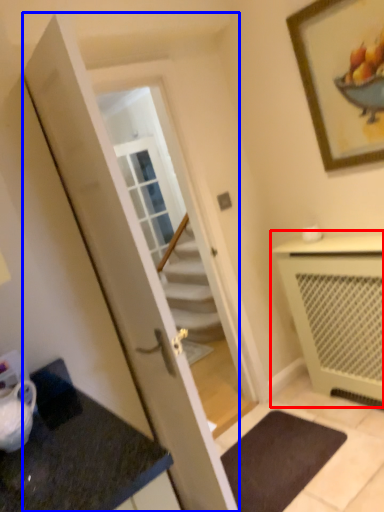
Question: Which point is further to the camera, cabinetry (highlighted by a red box) or door (highlighted by a blue box)?

Choices:
 (A) cabinetry
 (B) door

Answer: (A)